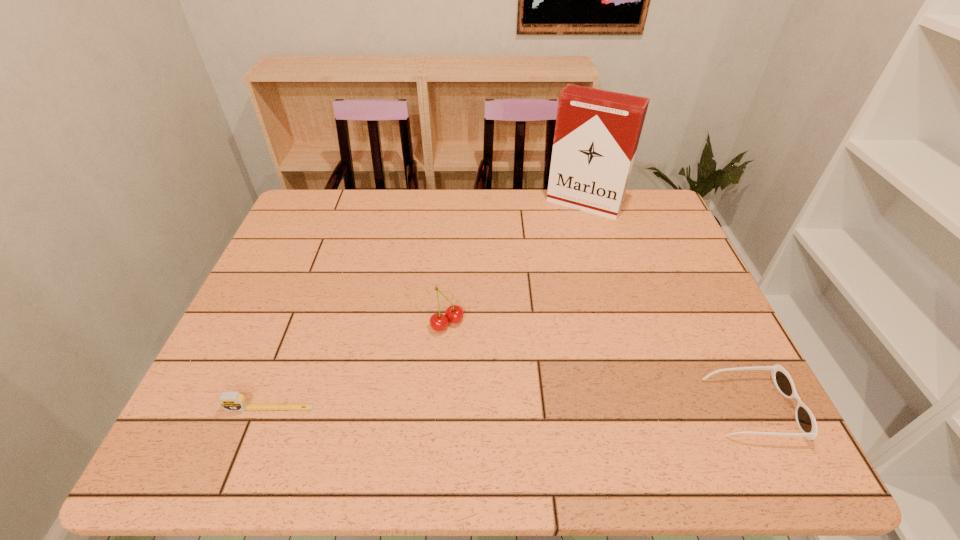
The height and width of the screenshot is (540, 960). I want to click on vacant spot on the desktop that is between the tape measure and the rightmost object and is positioned on the front-facing side of the farthest object, so click(x=464, y=408).

Find the location of a particular element. Image resolution: width=960 pixels, height=540 pixels. free space on the desktop that is between the tape measure and the sunglasses and is positioned with the stems of the second object from left to right pointing upwards is located at coordinates (523, 408).